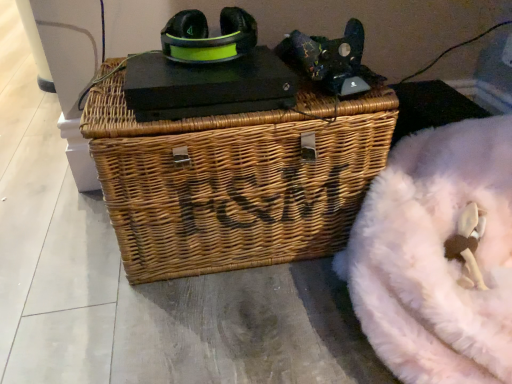
Question: Relative to woven brown picnic basket at center, is white fluffy bean bag at lower right, positioned as the second bean bag chair in top-to-bottom order, in front or behind?

Choices:
 (A) behind
 (B) front

Answer: (B)

Question: From the image's perspective, relative to woven brown picnic basket at center, is white fluffy bean bag at lower right, which is the 1th bean bag chair from bottom to top, above or below?

Choices:
 (A) below
 (B) above

Answer: (A)

Question: Estimate the real-world distances between objects in this image. Which object is farther from the white fluffy bean bag at lower right, which is the 1th bean bag chair from bottom to top?

Choices:
 (A) woven brown picnic basket at center
 (B) velvet-like pink bean bag at upper right, positioned as the 1th bean bag chair in top-to-bottom order
 (C) matte green plastic headphones at upper center

Answer: (C)

Question: Estimate the real-world distances between objects in this image. Which object is closer to the white fluffy bean bag at lower right, positioned as the second bean bag chair in top-to-bottom order?

Choices:
 (A) woven brown picnic basket at center
 (B) matte green plastic headphones at upper center
 (C) velvet-like pink bean bag at upper right, acting as the 2th bean bag chair starting from the bottom

Answer: (A)